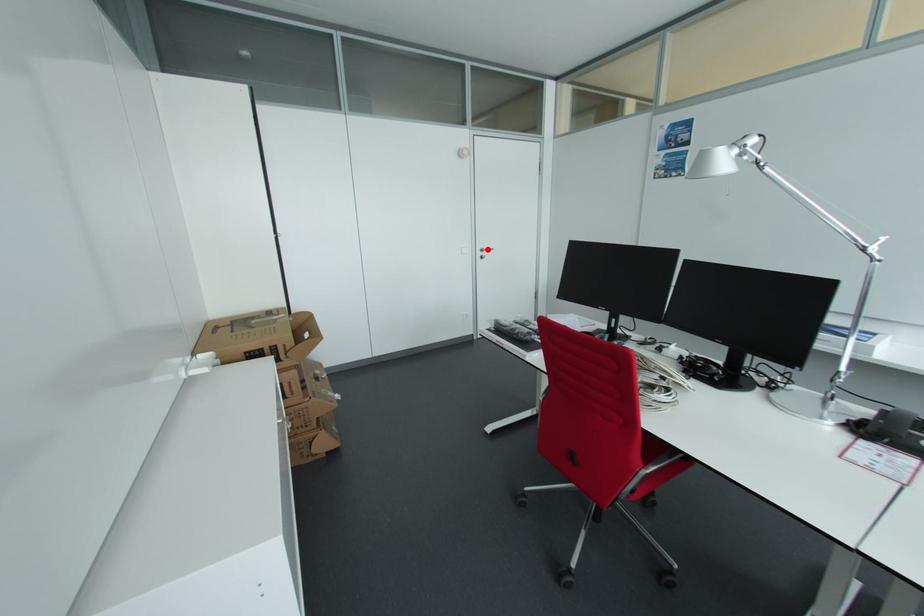
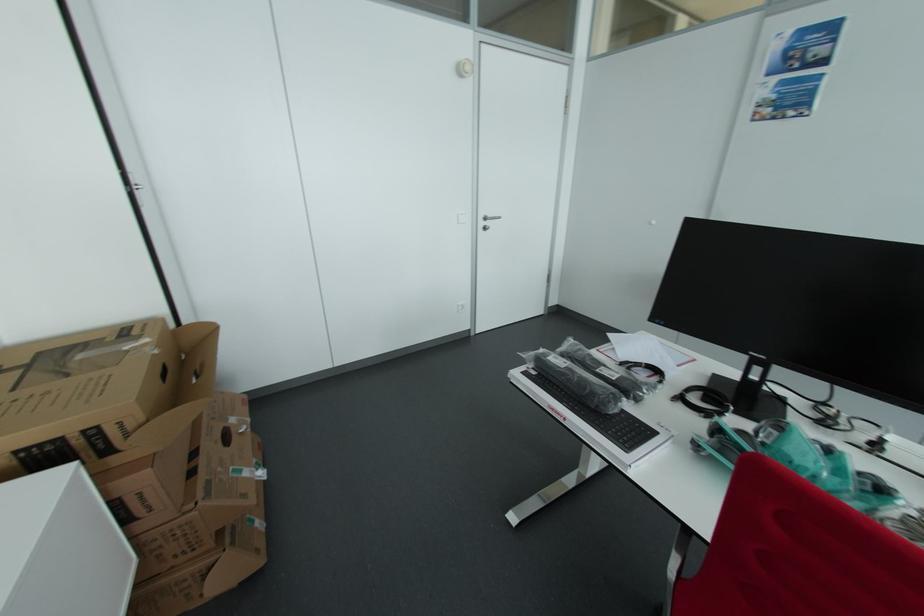
The point at the highlighted location is marked in the first image. Where is the corresponding point in the second image?

(493, 216)